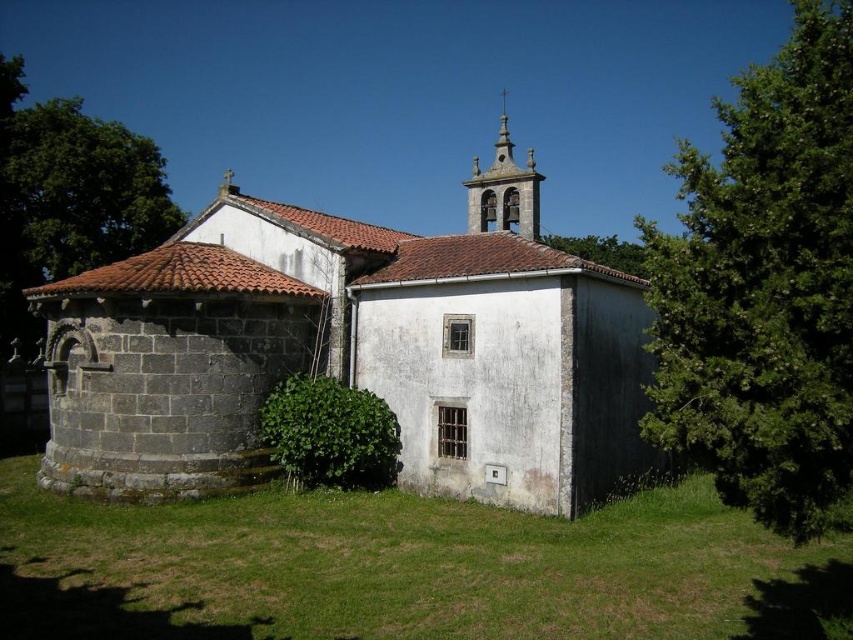
Is gray stone church at center behind green leafy tree at upper left?

No.

Who is shorter, gray stone church at center or green leafy tree at upper left?

gray stone church at center

Does point (99, 401) lie behind point (119, 220)?

No, it is in front of (119, 220).

This screenshot has height=640, width=853. Find the location of `gray stone church at center`. gray stone church at center is located at coordinates (347, 356).

Can you confirm if green leafy tree at right is positioned above green leafy tree at upper left?

Actually, green leafy tree at right is below green leafy tree at upper left.

Consider the image. Who is positioned more to the left, green leafy tree at right or green leafy tree at upper left?

From the viewer's perspective, green leafy tree at upper left appears more on the left side.

The width and height of the screenshot is (853, 640). I want to click on green leafy tree at right, so point(764,285).

Between smooth stone bell tower at upper center and green leafy tree at upper center, which one is positioned higher?

smooth stone bell tower at upper center

Which of these two, smooth stone bell tower at upper center or green leafy tree at upper center, stands taller?

With more height is smooth stone bell tower at upper center.

Does point (518, 189) come in front of point (613, 250)?

That is True.

Locate an element on the screen. Image resolution: width=853 pixels, height=640 pixels. smooth stone bell tower at upper center is located at coordinates (503, 189).